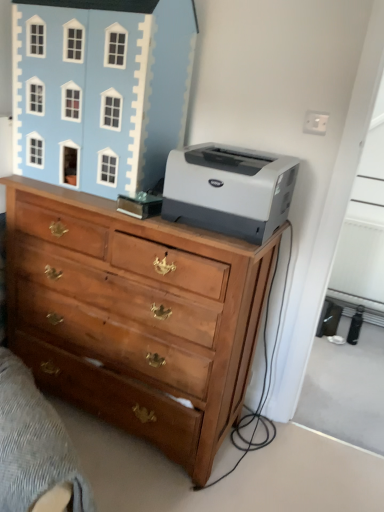
What do you see at coordinates (100, 90) in the screenshot?
I see `light blue painted wood dollhouse at upper left` at bounding box center [100, 90].

The height and width of the screenshot is (512, 384). Identify the location of gray matte printer at upper right. (229, 190).

Could you tell me if wooden chest of drawers at center is turned towards gray matte printer at upper right?

No, wooden chest of drawers at center does not turn towards gray matte printer at upper right.

The height and width of the screenshot is (512, 384). I want to click on printer that appears in front of the wooden chest of drawers at center, so click(x=229, y=190).

Is wooden chest of drawers at center to the left or to the right of gray matte printer at upper right in the image?

In the image, wooden chest of drawers at center appears on the left side of gray matte printer at upper right.

From a real-world perspective, is wooden chest of drawers at center on top of gray matte printer at upper right?

No, from a real-world perspective, wooden chest of drawers at center is not on top of gray matte printer at upper right.

Is gray matte printer at upper right not within wooden chest of drawers at center?

Yes, gray matte printer at upper right is located beyond the bounds of wooden chest of drawers at center.

Could you tell me if gray matte printer at upper right is facing wooden chest of drawers at center?

No, gray matte printer at upper right is not turned towards wooden chest of drawers at center.

Relative to wooden chest of drawers at center, is gray matte printer at upper right in front or behind?

gray matte printer at upper right is in front of wooden chest of drawers at center.

From the image's perspective, is gray matte printer at upper right under wooden chest of drawers at center?

No, from the image's perspective, gray matte printer at upper right is not beneath wooden chest of drawers at center.

How many degrees apart are the facing directions of light blue painted wood dollhouse at upper left and gray matte printer at upper right?

They differ by 0.651 degrees in their facing directions.

Is light blue painted wood dollhouse at upper left not near gray matte printer at upper right?

No, light blue painted wood dollhouse at upper left is not far from gray matte printer at upper right.

Which of these two, light blue painted wood dollhouse at upper left or gray matte printer at upper right, stands taller?

light blue painted wood dollhouse at upper left.

Is light blue painted wood dollhouse at upper left aimed at gray matte printer at upper right?

No, light blue painted wood dollhouse at upper left is not aimed at gray matte printer at upper right.

From the image's perspective, would you say light blue painted wood dollhouse at upper left is shown under wooden chest of drawers at center?

No, from the image's perspective, light blue painted wood dollhouse at upper left is not below wooden chest of drawers at center.

In the scene shown: Between light blue painted wood dollhouse at upper left and wooden chest of drawers at center, which one has less height?

light blue painted wood dollhouse at upper left.

From a real-world perspective, which object stands above the other?

In real-world perspective, light blue painted wood dollhouse at upper left is above.

Is light blue painted wood dollhouse at upper left smaller than wooden chest of drawers at center?

Correct, light blue painted wood dollhouse at upper left occupies less space than wooden chest of drawers at center.

Is wooden drawer at lower left wider than wooden chest of drawers at center?

Yes, wooden drawer at lower left is wider than wooden chest of drawers at center.

From the image's perspective, is wooden drawer at lower left on top of wooden chest of drawers at center?

No, from the image's perspective, wooden drawer at lower left is not on top of wooden chest of drawers at center.

Is wooden drawer at lower left taller or shorter than wooden chest of drawers at center?

Clearly, wooden drawer at lower left is shorter compared to wooden chest of drawers at center.

Is wooden drawer at lower left beside wooden chest of drawers at center?

No, wooden drawer at lower left is not making contact with wooden chest of drawers at center.

Between wooden drawer at lower left and light blue painted wood dollhouse at upper left, which one has larger width?

With larger width is wooden drawer at lower left.

Does wooden drawer at lower left have a smaller size compared to light blue painted wood dollhouse at upper left?

Indeed, wooden drawer at lower left has a smaller size compared to light blue painted wood dollhouse at upper left.

Does wooden drawer at lower left have a lesser height compared to light blue painted wood dollhouse at upper left?

Yes, wooden drawer at lower left is shorter than light blue painted wood dollhouse at upper left.

From a real-world perspective, is wooden drawer at lower left positioned over light blue painted wood dollhouse at upper left based on gravity?

No, from a real-world perspective, wooden drawer at lower left is not above light blue painted wood dollhouse at upper left.

Image resolution: width=384 pixels, height=512 pixels. Find the location of `printer on the right of light blue painted wood dollhouse at upper left`. printer on the right of light blue painted wood dollhouse at upper left is located at coordinates (229, 190).

Who is bigger, gray matte printer at upper right or light blue painted wood dollhouse at upper left?

With larger size is light blue painted wood dollhouse at upper left.

Considering the relative positions of gray matte printer at upper right and light blue painted wood dollhouse at upper left in the image provided, is gray matte printer at upper right to the right of light blue painted wood dollhouse at upper left from the viewer's perspective?

Correct, you'll find gray matte printer at upper right to the right of light blue painted wood dollhouse at upper left.

Is the surface of gray matte printer at upper right in direct contact with light blue painted wood dollhouse at upper left?

No, gray matte printer at upper right is not beside light blue painted wood dollhouse at upper left.

Image resolution: width=384 pixels, height=512 pixels. Identify the location of printer above the wooden chest of drawers at center (from the image's perspective). (229, 190).

Image resolution: width=384 pixels, height=512 pixels. In order to click on chest of drawers behind the gray matte printer at upper right in this screenshot , I will do `click(134, 316)`.

Looking at the image, which one is located closer to wooden drawer at lower left, gray matte printer at upper right or light blue painted wood dollhouse at upper left?

gray matte printer at upper right is positioned closer to the anchor wooden drawer at lower left.

From the image, which object appears to be farther from wooden drawer at lower left, gray matte printer at upper right or wooden chest of drawers at center?

Based on the image, gray matte printer at upper right appears to be further to wooden drawer at lower left.

Estimate the real-world distances between objects in this image. Which object is closer to wooden chest of drawers at center, wooden drawer at lower left or gray matte printer at upper right?

Among the two, wooden drawer at lower left is located nearer to wooden chest of drawers at center.

Which object lies further to the anchor point wooden chest of drawers at center, gray matte printer at upper right or wooden drawer at lower left?

gray matte printer at upper right is further to wooden chest of drawers at center.

From the image, which object appears to be nearer to light blue painted wood dollhouse at upper left, wooden drawer at lower left or gray matte printer at upper right?

gray matte printer at upper right.

Considering their positions, is wooden chest of drawers at center positioned closer to gray matte printer at upper right than wooden drawer at lower left?

wooden chest of drawers at center lies closer to gray matte printer at upper right than the other object.

Based on their spatial positions, is wooden drawer at lower left or light blue painted wood dollhouse at upper left further from gray matte printer at upper right?

wooden drawer at lower left is further to gray matte printer at upper right.

Which object lies further to the anchor point gray matte printer at upper right, light blue painted wood dollhouse at upper left or wooden chest of drawers at center?

light blue painted wood dollhouse at upper left lies further to gray matte printer at upper right than the other object.

The width and height of the screenshot is (384, 512). Find the location of `the chest of drawers that lies between gray matte printer at upper right and wooden drawer at lower left from top to bottom`. the chest of drawers that lies between gray matte printer at upper right and wooden drawer at lower left from top to bottom is located at coordinates (134, 316).

Where is `printer that lies between light blue painted wood dollhouse at upper left and wooden chest of drawers at center from top to bottom`? printer that lies between light blue painted wood dollhouse at upper left and wooden chest of drawers at center from top to bottom is located at coordinates (229, 190).

You are a GUI agent. You are given a task and a screenshot of the screen. Output one action in this format:
    pyautogui.click(x=<x>, y=<y>)
    Task: Click on the chest of drawers between light blue painted wood dollhouse at upper left and wooden drawer at lower left in the up-down direction
    
    Given the screenshot: What is the action you would take?
    pyautogui.click(x=134, y=316)

Find the location of a particular element. printer between light blue painted wood dollhouse at upper left and wooden drawer at lower left in the up-down direction is located at coordinates (229, 190).